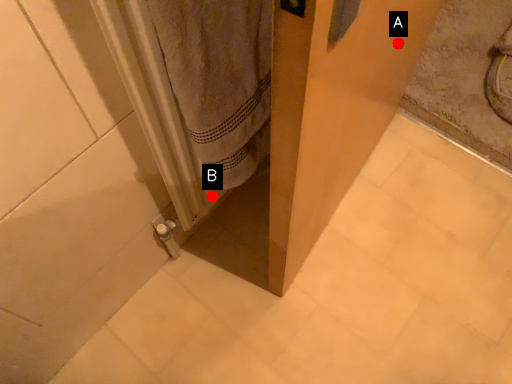
Question: Two points are circled on the image, labeled by A and B beside each circle. Among these points, which one is nearest to the camera?

Choices:
 (A) A is closer
 (B) B is closer

Answer: (A)